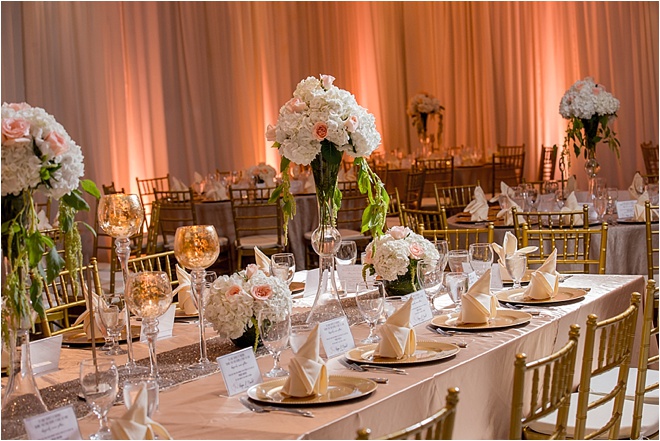
Where is `light on curtains`? This screenshot has height=441, width=660. light on curtains is located at coordinates (156, 153), (263, 151), (368, 88), (548, 120).